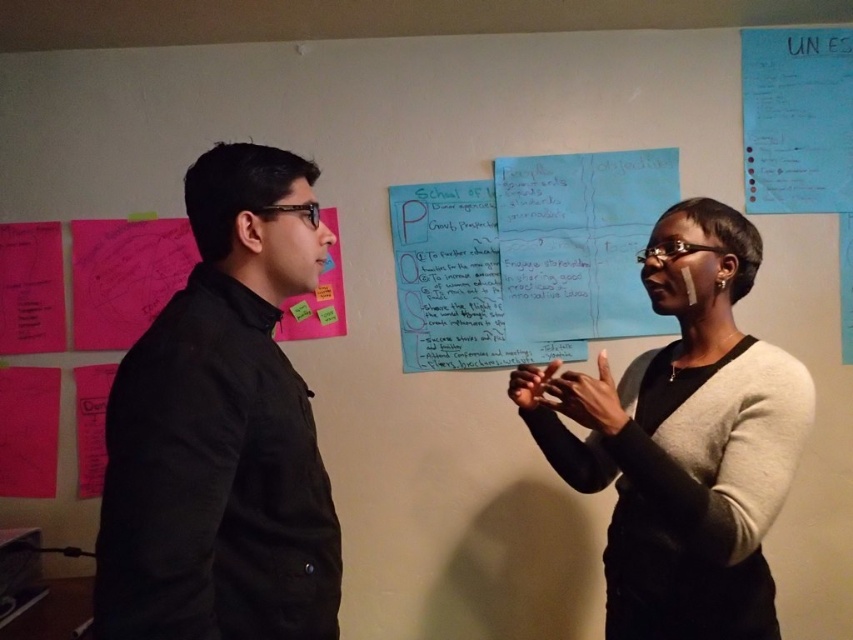
Question: Observing the image, what is the correct spatial positioning of black matte jacket at left in reference to black matte sweater at center?

Choices:
 (A) above
 (B) below

Answer: (A)

Question: From the image, what is the correct spatial relationship of black matte jacket at left in relation to black matte sweater at center?

Choices:
 (A) right
 (B) left

Answer: (B)

Question: Where is black matte jacket at left located in relation to black matte sweater at center in the image?

Choices:
 (A) right
 (B) left

Answer: (B)

Question: Which point is closer to the camera?

Choices:
 (A) (263, 493)
 (B) (708, 525)

Answer: (A)

Question: Which of the following is the closest to the observer?

Choices:
 (A) (242, 218)
 (B) (751, 272)

Answer: (A)